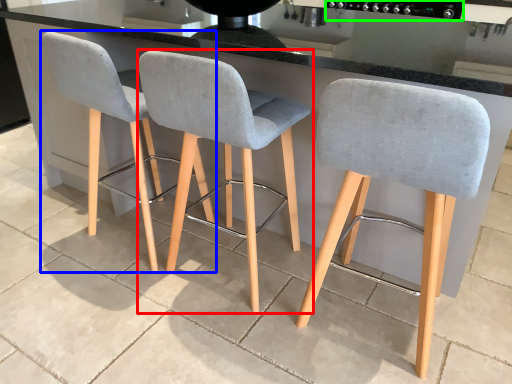
Question: Which object is the closest to the chair (highlighted by a red box)? Choose among these: chair (highlighted by a blue box) or appliance (highlighted by a green box).

Choices:
 (A) chair
 (B) appliance

Answer: (A)